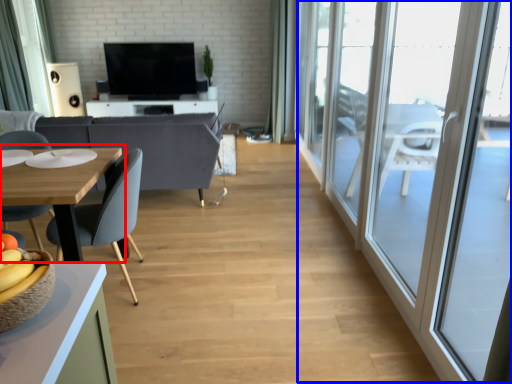
Question: Which object appears farthest to the camera in this image, table (highlighted by a red box) or screen door (highlighted by a blue box)?

Choices:
 (A) table
 (B) screen door

Answer: (A)